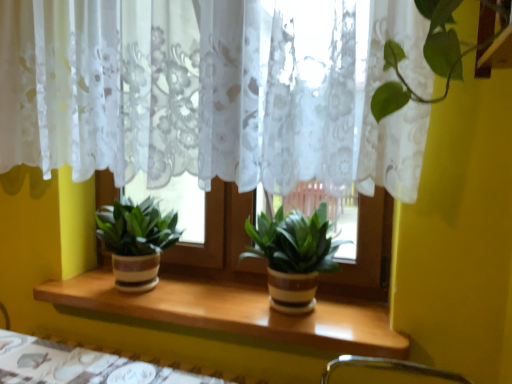
Identify the location of vacant space in between green matte plant at center, the 2th houseplant viewed from the right, and green matte plant at center, which ranks as the first houseplant in right-to-left order. This screenshot has height=384, width=512. (206, 299).